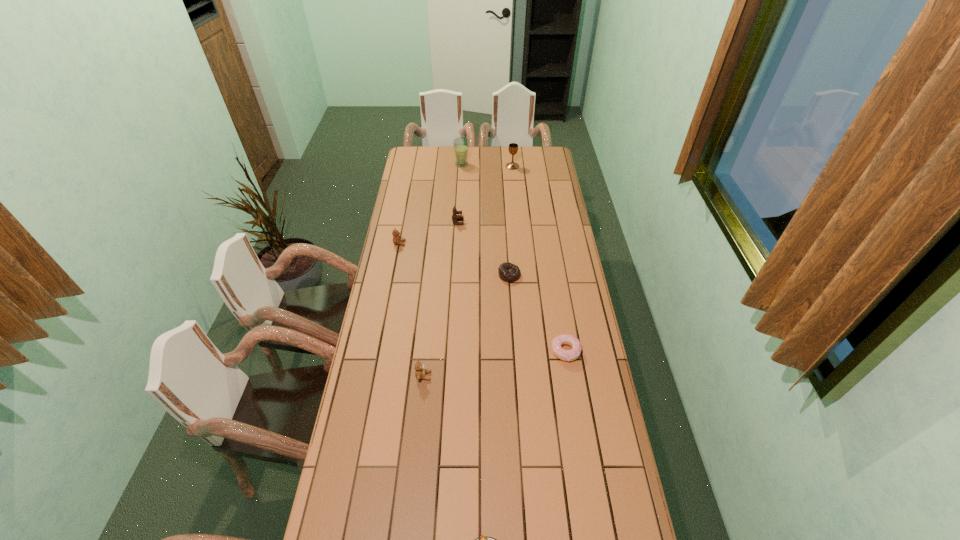
This screenshot has width=960, height=540. Identify the location of doughnut. (566, 355).

The image size is (960, 540). Find the location of `free space located on the front of the glass`. free space located on the front of the glass is located at coordinates (461, 181).

In order to click on vacant space located 0.280m on the front of the chalice in this screenshot , I will do `click(516, 199)`.

Image resolution: width=960 pixels, height=540 pixels. What are the coordinates of `vacant area located on the face of the rightmost teddy bear` in the screenshot? It's located at (480, 222).

The height and width of the screenshot is (540, 960). I want to click on vacant space situated on the face of the second nearest teddy bear, so click(x=478, y=243).

This screenshot has height=540, width=960. Find the location of `free point located 0.060m on the front-facing side of the nearest teddy bear`. free point located 0.060m on the front-facing side of the nearest teddy bear is located at coordinates pyautogui.click(x=448, y=376).

Find the location of `vacant point located 0.290m on the front of the fourth nearest object`. vacant point located 0.290m on the front of the fourth nearest object is located at coordinates [514, 338].

In order to click on free location located on the front of the doughnut in this screenshot , I will do `click(576, 415)`.

Where is `glass that is at the far edge`? This screenshot has width=960, height=540. glass that is at the far edge is located at coordinates (461, 144).

I want to click on chalice located at the far edge, so tap(513, 147).